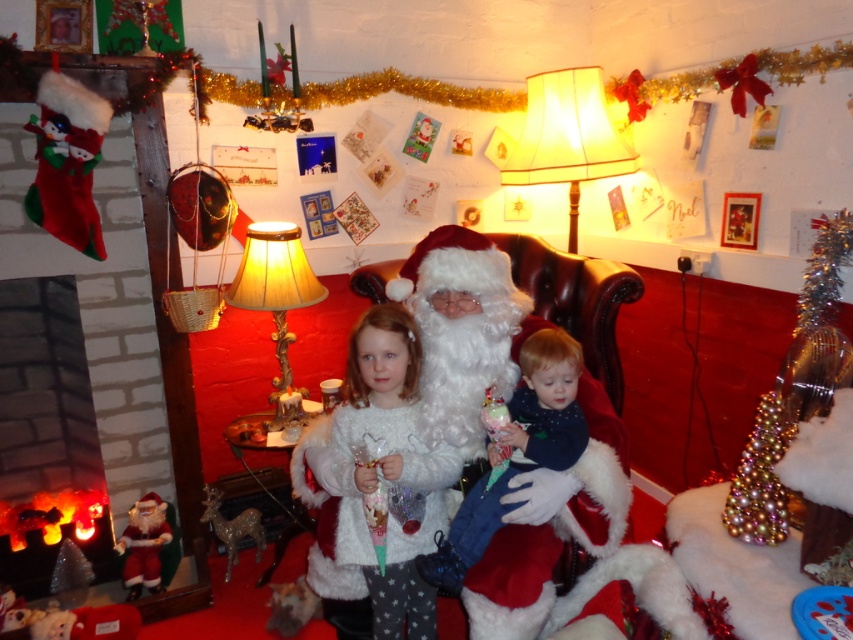
You are a photographer setting up for a Christmas photo shoot. You need to ensure that the white fluffy sweater at center and the brick fireplace at left are both visible in the frame. Based on their sizes, which object should you focus on to ensure both are in the shot?

The white fluffy sweater at center is larger in size than the brick fireplace at left, so you should focus on the white fluffy sweater at center to ensure both are in the shot.